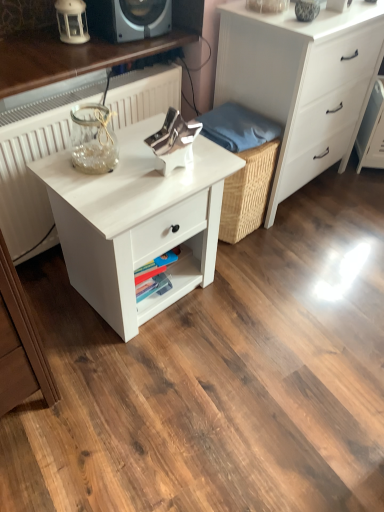
This screenshot has width=384, height=512. I want to click on free space in front of white matte chest of drawers at center, so click(x=307, y=245).